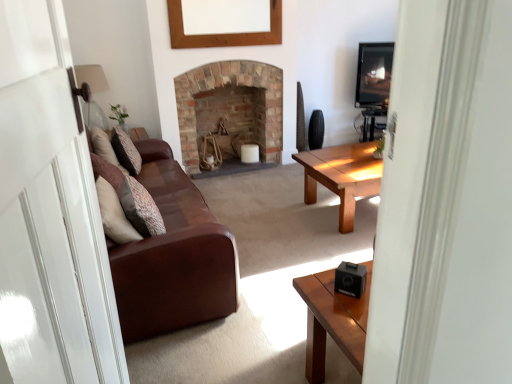
Locate an element on the screen. free space in front of black plastic speaker at lower right is located at coordinates (347, 312).